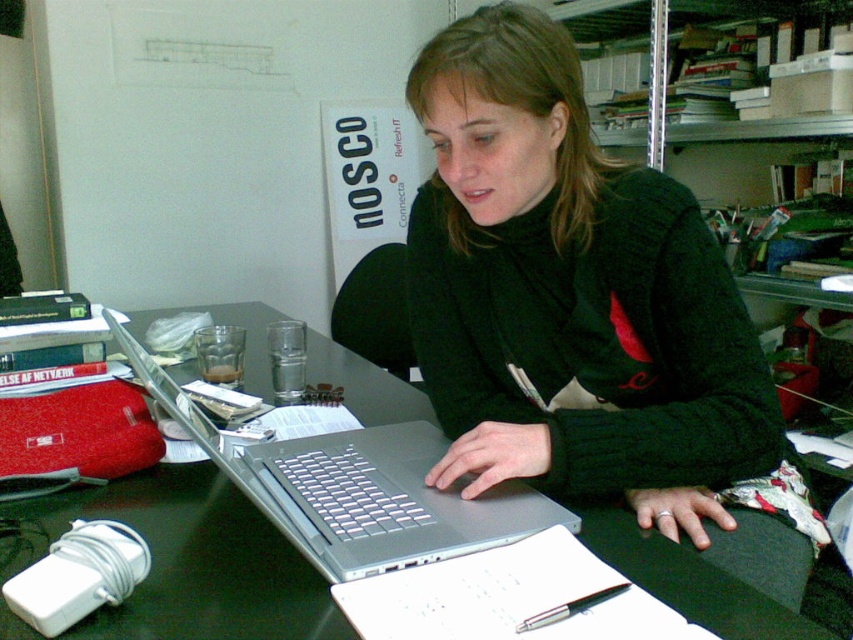
Question: Which of the following is the farthest from the observer?

Choices:
 (A) silver metallic laptop at center
 (B) metallic gray table at center

Answer: (B)

Question: Where is black matte sweater at center located in relation to silver metallic laptop at center in the image?

Choices:
 (A) above
 (B) below

Answer: (A)

Question: Which point is farther to the camera?

Choices:
 (A) silver metallic laptop at center
 (B) metallic gray table at center
 (C) black matte sweater at center

Answer: (B)

Question: Does black matte sweater at center have a lesser width compared to metallic gray table at center?

Choices:
 (A) yes
 (B) no

Answer: (A)

Question: Is black matte sweater at center bigger than metallic gray table at center?

Choices:
 (A) no
 (B) yes

Answer: (A)

Question: Estimate the real-world distances between objects in this image. Which object is closer to the silver metallic laptop at center?

Choices:
 (A) metallic gray table at center
 (B) black matte sweater at center

Answer: (A)